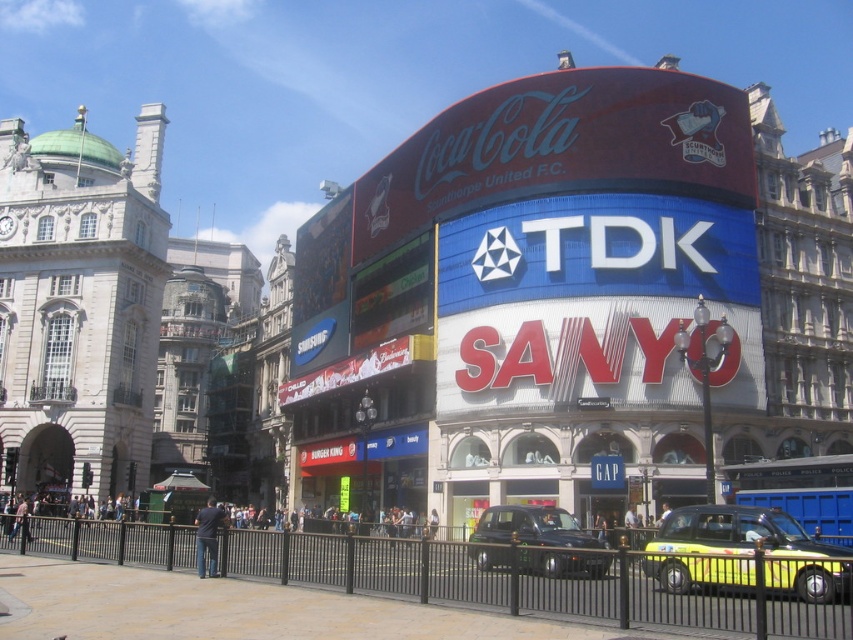
Question: Which is farther from the yellow metallic taxi at lower right?

Choices:
 (A) black rubber taxi at center
 (B) matte plastic sign at center

Answer: (B)

Question: Estimate the real-world distances between objects in this image. Which object is closer to the matte red signboard at upper center?

Choices:
 (A) matte plastic sign at center
 (B) yellow metallic taxi at lower right
 (C) black metal fence at lower center
 (D) red metallic sign at center

Answer: (A)

Question: Estimate the real-world distances between objects in this image. Which object is closer to the matte red signboard at upper center?

Choices:
 (A) black rubber taxi at center
 (B) yellow metallic taxi at lower right

Answer: (A)

Question: Is blue metallic bus at center positioned in front of black rubber taxi at center?

Choices:
 (A) no
 (B) yes

Answer: (A)

Question: Does matte plastic sign at center appear on the right side of white glossy samsung sign at center?

Choices:
 (A) yes
 (B) no

Answer: (A)

Question: Is matte plastic sign at center further to camera compared to black rubber taxi at center?

Choices:
 (A) no
 (B) yes

Answer: (B)